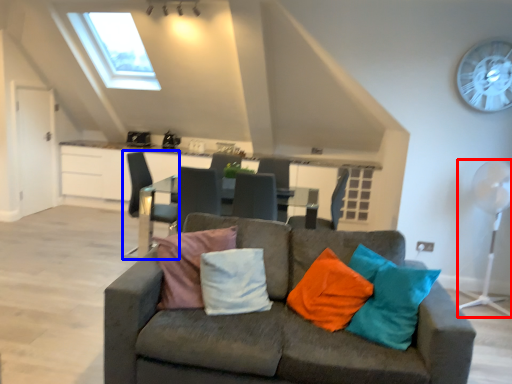
Question: Which object is further to the camera taking this photo, mechanical fan (highlighted by a red box) or chair (highlighted by a blue box)?

Choices:
 (A) mechanical fan
 (B) chair

Answer: (B)